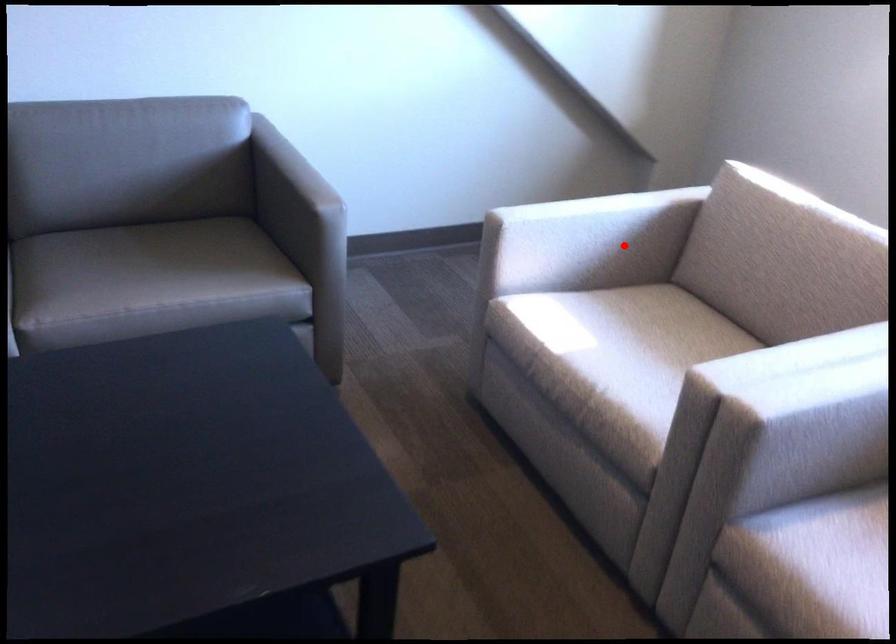
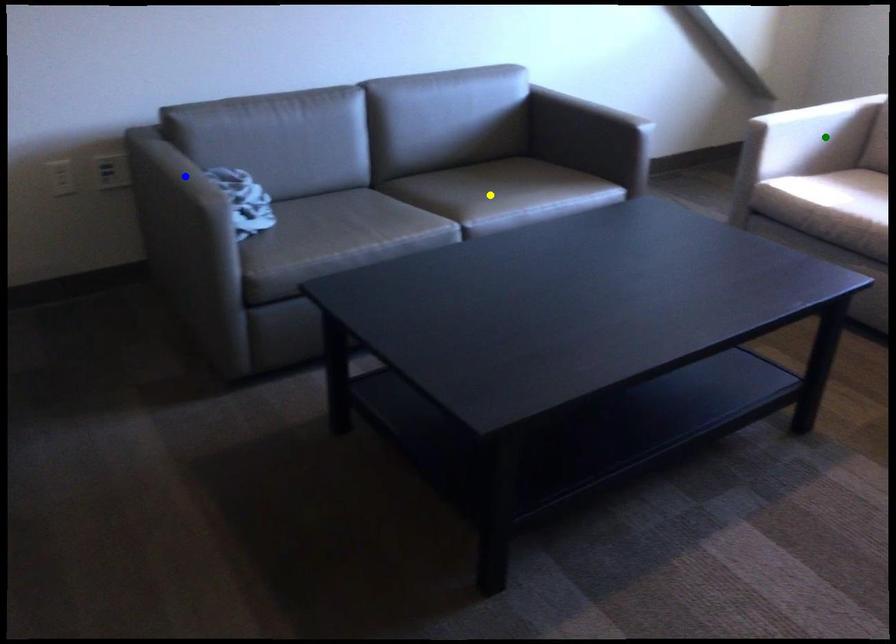
Question: I am providing you with two images of the same scene from different viewpoints. A red point is marked on the first image. You are given multiple points on the second image. Can you choose the point in image 2 that corresponds to the point in image 1?

Choices:
 (A) yellow point
 (B) green point
 (C) blue point

Answer: (B)